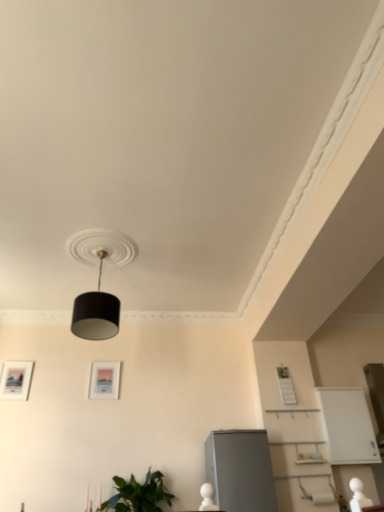
Question: Considering their positions, is black matte lampshade at center located in front of or behind white matte picture frame at upper right, which is counted as the third picture frame, starting from the left?

Choices:
 (A) behind
 (B) front

Answer: (B)

Question: From a real-world perspective, is black matte lampshade at center positioned above or below white matte picture frame at upper right, which is counted as the third picture frame, starting from the left?

Choices:
 (A) above
 (B) below

Answer: (A)

Question: Based on their relative distances, which object is farther from the white matte picture frame at upper right, positioned as the 1th picture frame in right-to-left order?

Choices:
 (A) matte black picture frame at left, which is counted as the 1th picture frame, starting from the left
 (B) black matte lampshade at center
 (C) matte white picture frame at center, placed as the second picture frame when sorted from left to right
 (D) satin grey refrigerator at lower right
 (E) white glossy cabinet at lower right

Answer: (A)

Question: Which of these objects is positioned farthest from the white matte picture frame at upper right, which is counted as the third picture frame, starting from the left?

Choices:
 (A) white glossy cabinet at lower right
 (B) black matte lampshade at center
 (C) matte white picture frame at center, placed as the second picture frame when sorted from left to right
 (D) green leafy plant at lower left
 (E) satin grey refrigerator at lower right

Answer: (B)